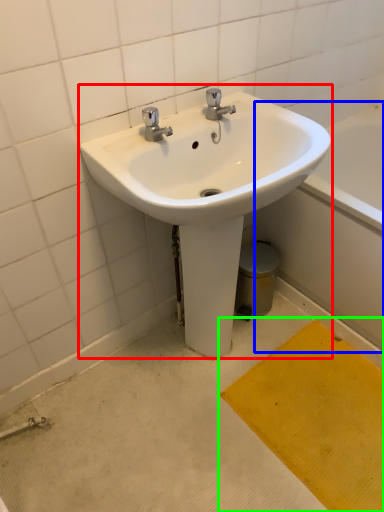
Question: Which object is the farthest from sink (highlighted by a red box)? Choose among these: bath (highlighted by a blue box) or doormat (highlighted by a green box).

Choices:
 (A) bath
 (B) doormat

Answer: (B)